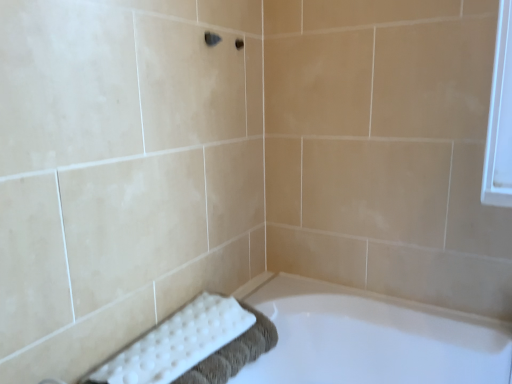
Question: Is white textured bath towel at lower left taller or shorter than white glossy bathtub at lower center?

Choices:
 (A) short
 (B) tall

Answer: (A)

Question: Which is correct: white textured bath towel at lower left is inside white glossy bathtub at lower center, or outside of it?

Choices:
 (A) inside
 (B) outside

Answer: (B)

Question: From the image's perspective, is white textured bath towel at lower left positioned above or below white glossy bathtub at lower center?

Choices:
 (A) above
 (B) below

Answer: (A)

Question: Is white glossy bathtub at lower center to the left or to the right of white textured bath towel at lower left in the image?

Choices:
 (A) left
 (B) right

Answer: (B)

Question: In the image, is white glossy bathtub at lower center positioned in front of or behind white textured bath towel at lower left?

Choices:
 (A) behind
 (B) front

Answer: (B)

Question: Is point tap(410, 369) positioned closer to the camera than point tap(202, 294)?

Choices:
 (A) farther
 (B) closer

Answer: (B)

Question: From the image's perspective, is white glossy bathtub at lower center above or below white textured bath towel at lower left?

Choices:
 (A) below
 (B) above

Answer: (A)